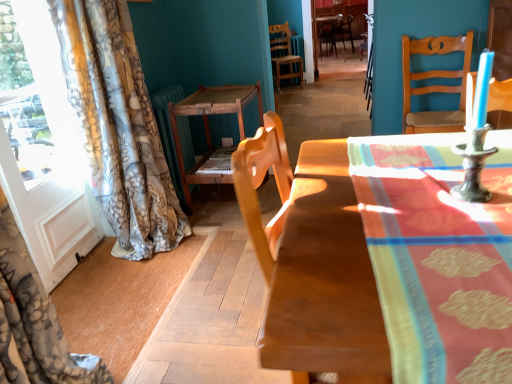
Question: Is point (317, 31) positioned closer to the camera than point (428, 119)?

Choices:
 (A) farther
 (B) closer

Answer: (A)

Question: Would you say wooden chair at center, which is the first chair from top to bottom, is to the left or to the right of wooden chair at right, the 2th chair viewed from the right, in the picture?

Choices:
 (A) right
 (B) left

Answer: (A)

Question: Estimate the real-world distances between objects in this image. Which object is farther from the metallic candle holder at right?

Choices:
 (A) wooden chair at center, placed as the 2th chair when sorted from front to back
 (B) transparent glass door at left
 (C) wooden chair at right, which appears as the 2th chair when viewed from the left
 (D) wooden chair at center, acting as the first chair starting from the back
 (E) wooden table at center, which is counted as the 1th table, starting from the right

Answer: (D)

Question: Based on their relative distances, which object is farther from the wooden table at center, the second table when ordered from left to right?

Choices:
 (A) wooden chair at right, the first chair from the bottom
 (B) wooden table at center, which ranks as the 1th table in left-to-right order
 (C) wooden chair at center, the second chair ordered from the bottom
 (D) wooden chair at center, marked as the 3th chair in a front-to-back arrangement
 (E) floral-patterned fabric at left

Answer: (D)